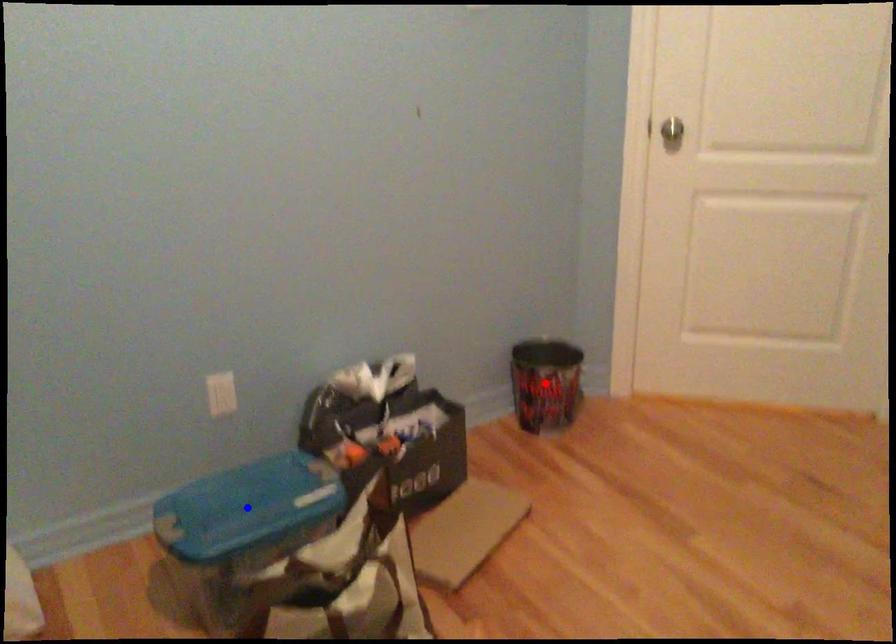
Question: Two points are marked on the image. Which point is closer to the camera?

Choices:
 (A) Blue point is closer.
 (B) Red point is closer.

Answer: (A)